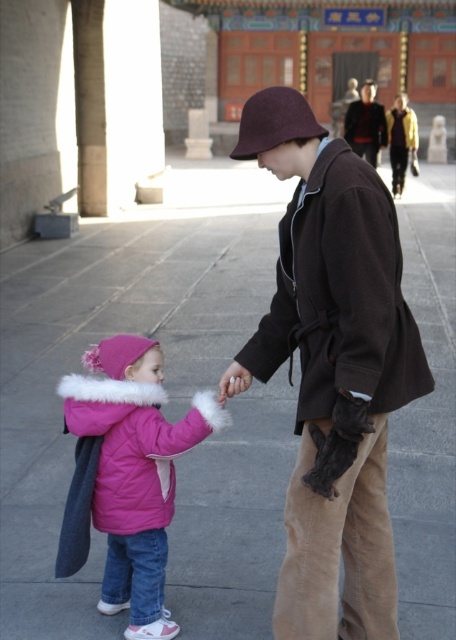
You are a photographer standing in the courtyard and want to take a photo of the gray concrete pavement at center and the dark brown leather jacket at upper center. Which object is lower in the frame?

The gray concrete pavement at center is lower in the frame compared to the dark brown leather jacket at upper center because it has a lesser height.